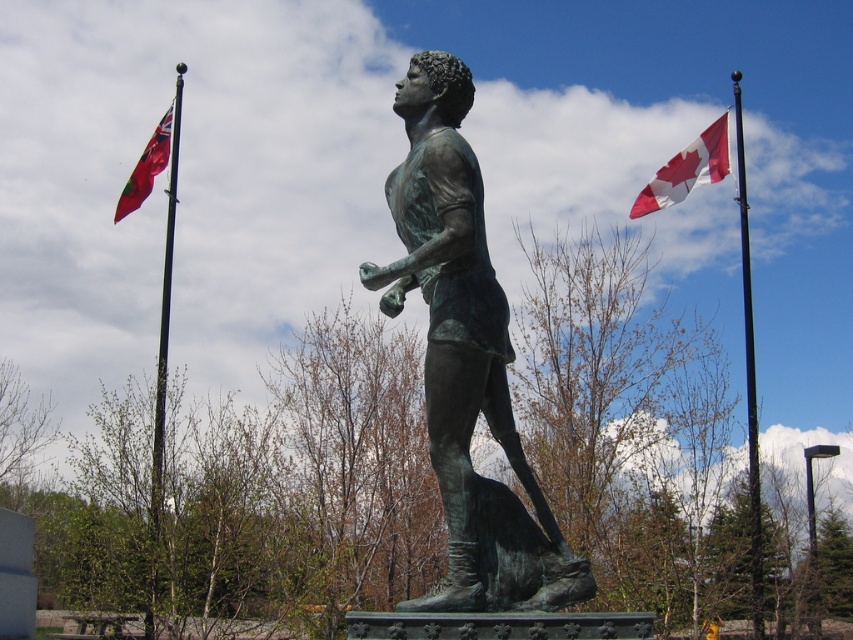
Does point (527, 557) lie in front of point (723, 144)?

Yes, it is in front of point (723, 144).

Is bronze statue at center closer to the viewer compared to red and white fabric flag at upper right?

Yes, it is.

You are a GUI agent. You are given a task and a screenshot of the screen. Output one action in this format:
    pyautogui.click(x=<x>, y=<y>)
    Task: Click on the bronze statue at center
    This screenshot has width=853, height=640.
    Given the screenshot: What is the action you would take?
    pyautogui.click(x=465, y=358)

Between black metal pole at upper right and red and white fabric flag at upper right, which one has less height?

Standing shorter between the two is red and white fabric flag at upper right.

Which is in front, point (750, 387) or point (659, 182)?

Point (750, 387) is more forward.

Is point (755, 484) positioned after point (663, 180)?

No, it is in front of (663, 180).

Find the location of a particular element. black metal pole at upper right is located at coordinates (749, 380).

Can you confirm if polished metal flagpole at left is taller than red and white fabric flag at upper right?

Correct, polished metal flagpole at left is much taller as red and white fabric flag at upper right.

Does point (177, 140) lie in front of point (712, 132)?

Yes, it is in front of point (712, 132).

Is point (154, 497) in front of point (640, 208)?

Yes, it is in front of point (640, 208).

The width and height of the screenshot is (853, 640). I want to click on polished metal flagpole at left, so click(161, 333).